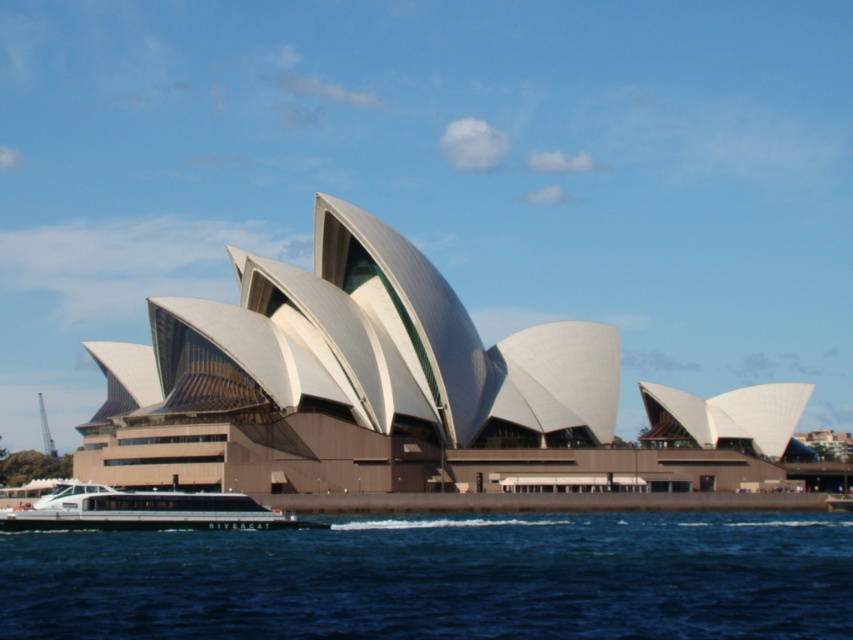
Who is more distant from viewer, [335,392] or [204,522]?

The point [335,392] is behind.

Between white smooth building at center and white glossy boat at lower left, which one appears on the left side from the viewer's perspective?

white glossy boat at lower left

Who is more forward, (190, 342) or (129, 502)?

Point (129, 502)

Locate an element on the screen. This screenshot has width=853, height=640. white smooth building at center is located at coordinates (395, 388).

From the picture: Is blue water at lower center below white glossy boat at lower left?

Yes, blue water at lower center is below white glossy boat at lower left.

Which is more to the right, blue water at lower center or white glossy boat at lower left?

From the viewer's perspective, blue water at lower center appears more on the right side.

Identify the location of blue water at lower center. The height and width of the screenshot is (640, 853). (440, 579).

Which is in front, point (74, 472) or point (194, 547)?

Point (194, 547)

Can you confirm if white smooth building at center is wider than blue water at lower center?

Correct, the width of white smooth building at center exceeds that of blue water at lower center.

Who is more distant from viewer, [521,422] or [131,536]?

Positioned behind is point [521,422].

What are the coordinates of `white smooth building at center` in the screenshot? It's located at (395, 388).